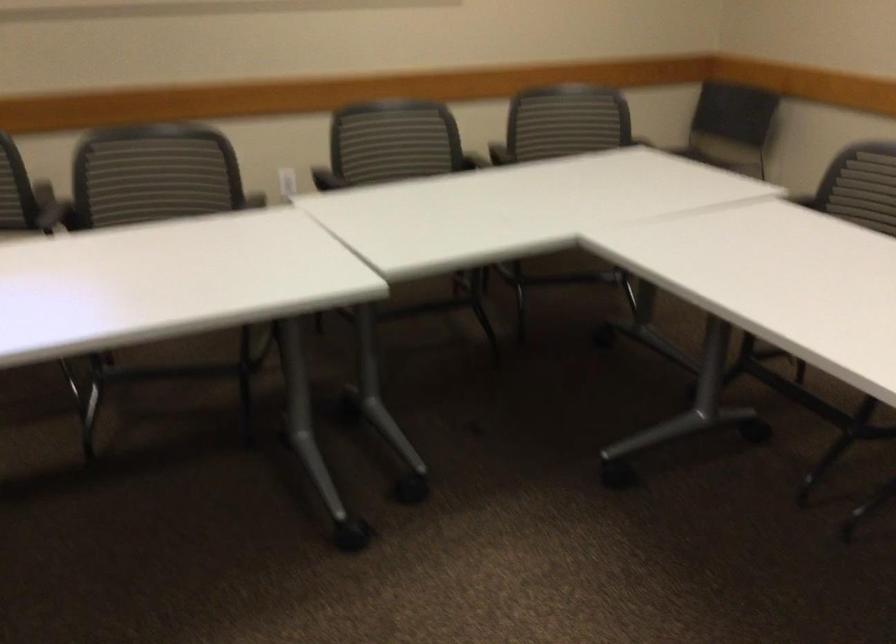
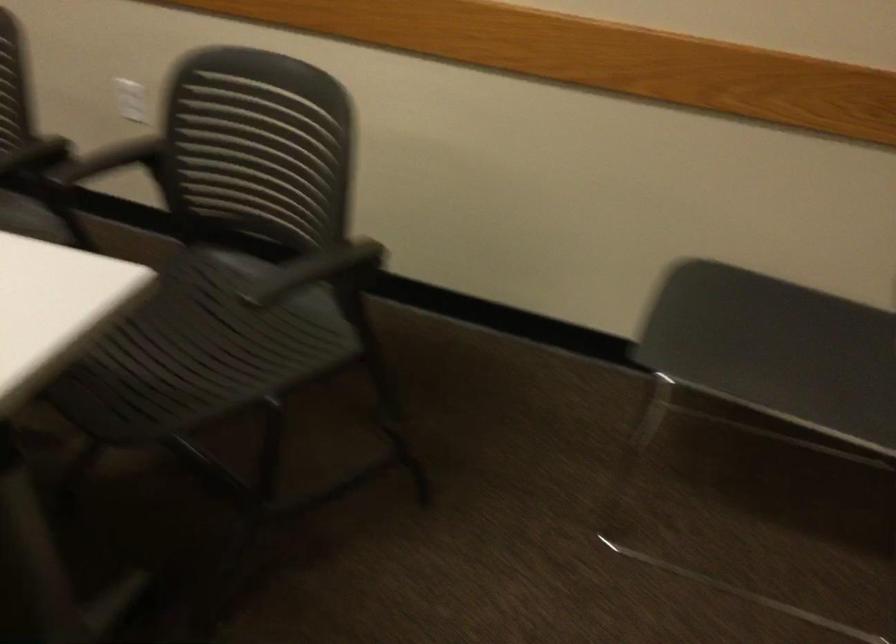
Question: I am providing you with two images of the same scene from different viewpoints. Please identify which objects are invisible in image2.

Choices:
 (A) green clothes hanger
 (B) chair armrest
 (C) black chair armrest
 (D) chair sitting surface

Answer: (B)